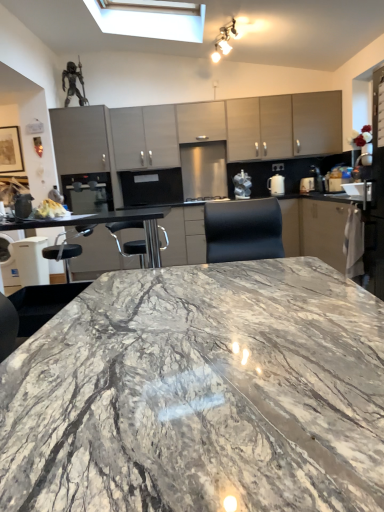
Question: From a real-world perspective, is matte gray cabinets at center, the 1th cabinetry in the left-to-right sequence, physically above satin black coffee machine at center, marked as the third appliance in a right-to-left arrangement?

Choices:
 (A) no
 (B) yes

Answer: (B)

Question: Does matte gray cabinets at center, the 3th cabinetry viewed from the right, turn towards satin black coffee machine at center, the first appliance positioned from the left?

Choices:
 (A) no
 (B) yes

Answer: (A)

Question: Does matte gray cabinets at center, the 1th cabinetry in the left-to-right sequence, have a greater height compared to satin black coffee machine at center, the first appliance positioned from the left?

Choices:
 (A) no
 (B) yes

Answer: (B)

Question: Does matte gray cabinets at center, the 3th cabinetry viewed from the right, have a lesser width compared to satin black coffee machine at center, the first appliance positioned from the left?

Choices:
 (A) yes
 (B) no

Answer: (A)

Question: From a real-world perspective, is matte gray cabinets at center, the 1th cabinetry in the left-to-right sequence, beneath satin black coffee machine at center, the first appliance positioned from the left?

Choices:
 (A) yes
 (B) no

Answer: (B)

Question: Does point (221, 30) appear closer or farther from the camera than point (195, 124)?

Choices:
 (A) farther
 (B) closer

Answer: (B)

Question: Is white glossy light fixture at upper center inside the boundaries of matte gray cabinet at upper center, which ranks as the second cabinetry in left-to-right order, or outside?

Choices:
 (A) outside
 (B) inside

Answer: (A)

Question: Would you say white glossy light fixture at upper center is to the left or to the right of matte gray cabinet at upper center, which ranks as the second cabinetry in left-to-right order, in the picture?

Choices:
 (A) right
 (B) left

Answer: (A)

Question: From a real-world perspective, is white glossy light fixture at upper center positioned above or below matte gray cabinet at upper center, the second cabinetry in the right-to-left sequence?

Choices:
 (A) above
 (B) below

Answer: (A)

Question: Considering the positions of matte gray cabinets at upper center, the third cabinetry in the left-to-right sequence, and white crumbly bread at left in the image, is matte gray cabinets at upper center, the third cabinetry in the left-to-right sequence, bigger or smaller than white crumbly bread at left?

Choices:
 (A) small
 (B) big

Answer: (B)

Question: Is matte gray cabinets at upper center, the third cabinetry in the left-to-right sequence, in front of or behind white crumbly bread at left in the image?

Choices:
 (A) front
 (B) behind

Answer: (B)

Question: In terms of height, does matte gray cabinets at upper center, the third cabinetry in the left-to-right sequence, look taller or shorter compared to white crumbly bread at left?

Choices:
 (A) tall
 (B) short

Answer: (A)

Question: Is point (238, 159) positioned closer to the camera than point (56, 204)?

Choices:
 (A) farther
 (B) closer

Answer: (A)

Question: Would you say satin black coffee machine at center, the first appliance positioned from the left, is inside or outside white glossy kettle at right, which is counted as the first appliance, starting from the right?

Choices:
 (A) inside
 (B) outside

Answer: (B)

Question: Based on their positions, is satin black coffee machine at center, the first appliance positioned from the left, located to the left or right of white glossy kettle at right, acting as the third appliance starting from the left?

Choices:
 (A) left
 (B) right

Answer: (A)